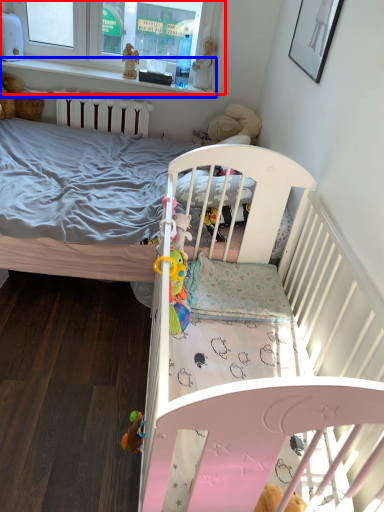
Question: Among these objects, which one is farthest to the camera, window frame (highlighted by a red box) or balustrade (highlighted by a blue box)?

Choices:
 (A) window frame
 (B) balustrade

Answer: (B)